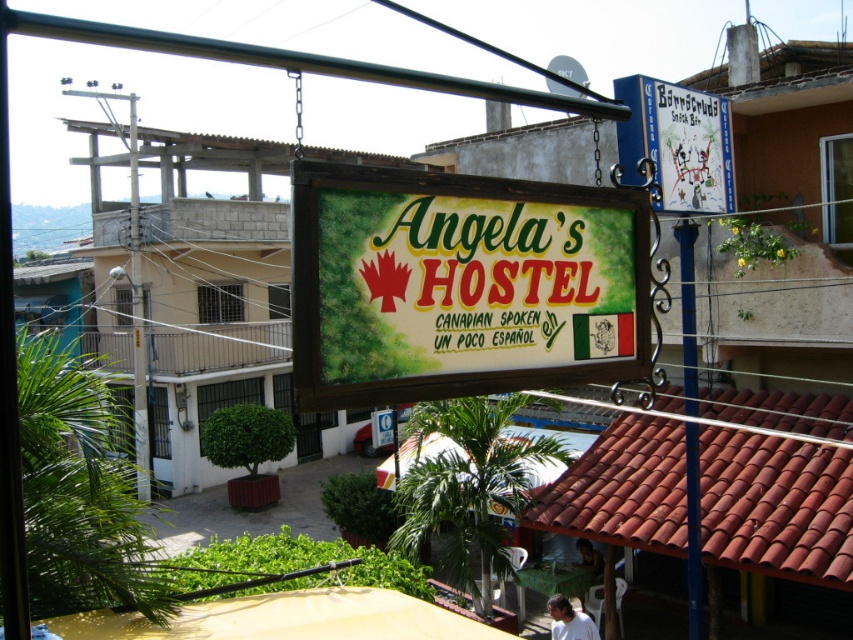
You are a traveler who wants to read the hostel sign clearly. You notice the blue painted wood sign at upper right and the blue metal pole at center. Which object is shorter in height?

The blue painted wood sign at upper right has a lesser height compared to the blue metal pole at center, so the blue painted wood sign at upper right is shorter in height.

You are standing in front of the hostel sign and want to touch both points mentioned. Which point should you reach for first, the point at coordinate (717, 134) or the point at (683, 257)?

You should reach for the point at coordinate (717, 134) first because it is closer to you than the point at (683, 257), which is further away.

You are a traveler standing in front of Angela Hostel. You see a blue metal pole at center and a white fabric shirt at lower center. Which object is positioned more to the right?

The blue metal pole at center is positioned more to the right than the white fabric shirt at lower center.